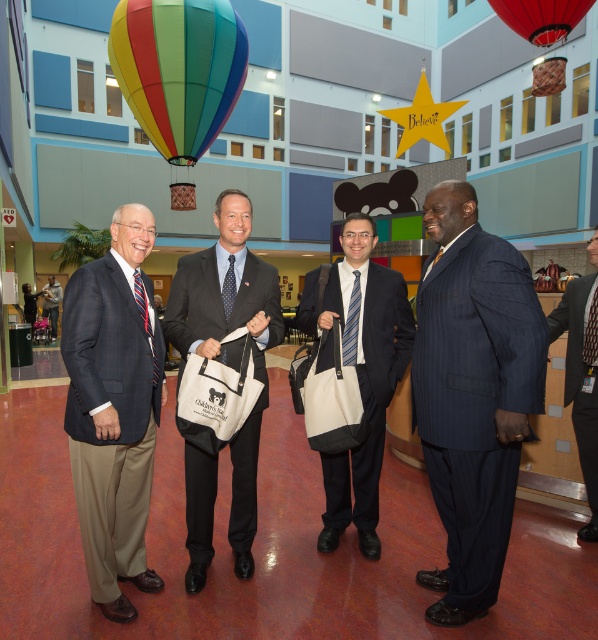
You are a photographer at the event and need to capture a photo of the matte black suit at left and the matte white bag at center. Based on their positions, which object is located more to the left?

The matte black suit at left is positioned on the left side of the matte white bag at center, so the matte black suit at left is more to the left.